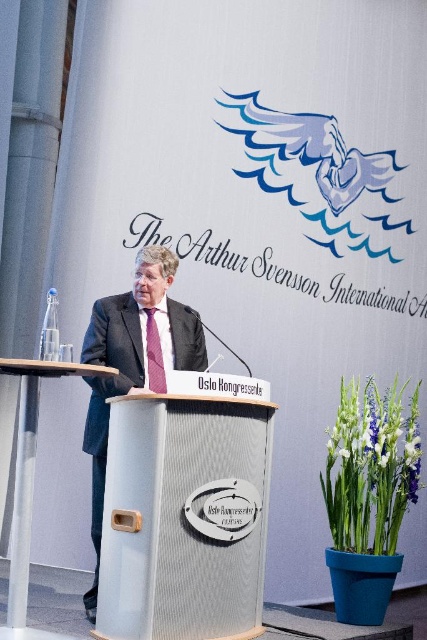
Is matte silver podium at center further to camera compared to dark gray suit at center?

That is False.

Does point (202, 536) lie behind point (201, 324)?

No, it is not.

Where is `matte silver podium at center`? This screenshot has height=640, width=427. matte silver podium at center is located at coordinates (184, 518).

Does dark gray suit at center have a lesser height compared to pink satin tie at center?

In fact, dark gray suit at center may be taller than pink satin tie at center.

Is point (98, 442) closer to camera compared to point (157, 372)?

Yes, it is.

Locate an element on the screen. dark gray suit at center is located at coordinates (131, 362).

Between matte silver podium at center and pink satin tie at center, which one is positioned lower?

matte silver podium at center is below.

Can you confirm if matte silver podium at center is positioned to the right of pink satin tie at center?

Yes, matte silver podium at center is to the right of pink satin tie at center.

Does point (158, 582) come behind point (146, 330)?

No, (158, 582) is in front of (146, 330).

Locate an element on the screen. This screenshot has height=640, width=427. matte silver podium at center is located at coordinates (184, 518).